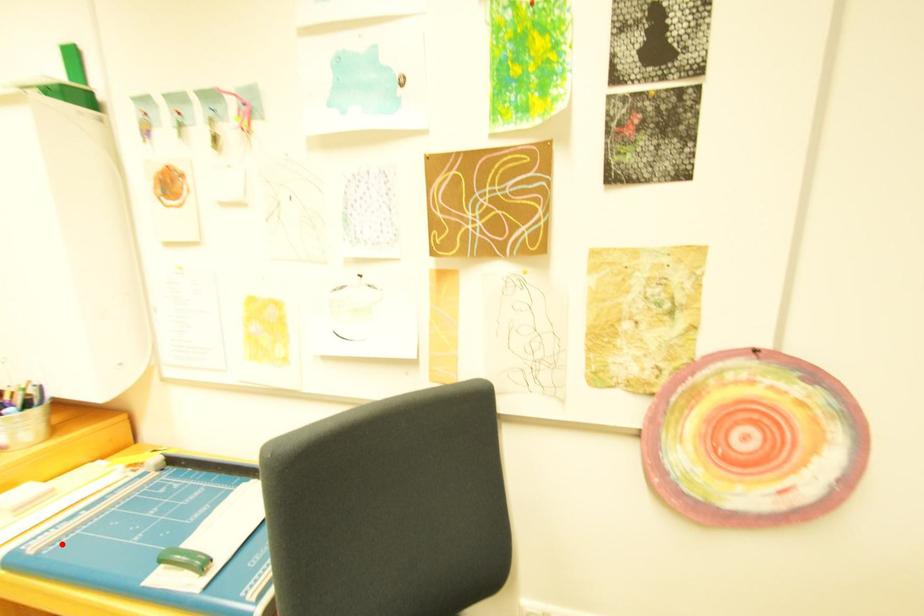
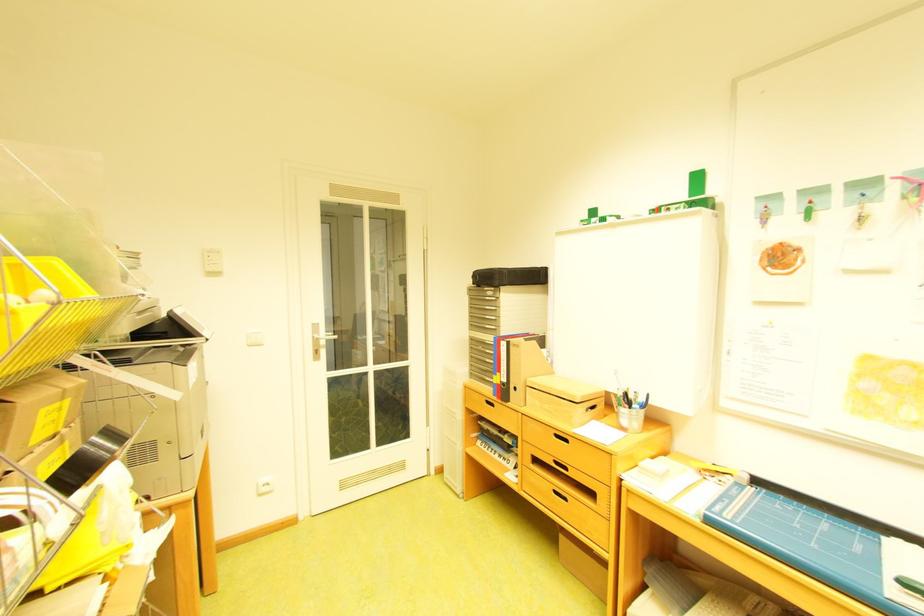
Question: I am providing you with two images of the same scene from different viewpoints. In image1, a red point is highlighted. Considering the same 3D point in image2, which of the following is correct?

Choices:
 (A) It is closer
 (B) It is farther

Answer: (B)